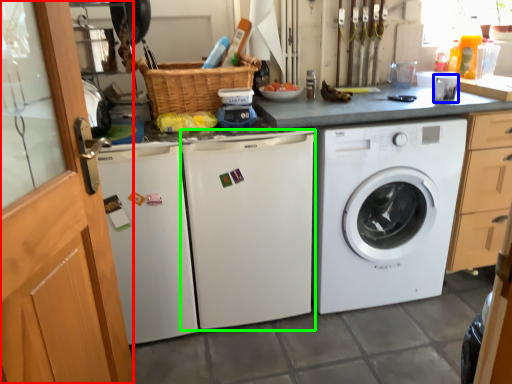
Question: Based on their relative distances, which object is farther from screen door (highlighted by a red box)? Choose from appliance (highlighted by a blue box) and washing machine (highlighted by a green box).

Choices:
 (A) appliance
 (B) washing machine

Answer: (A)